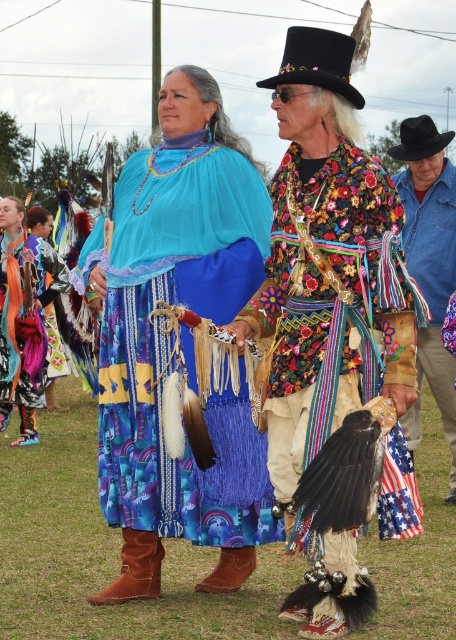
Between blue woven skirt at center and blue fabric dress at center, which one has more height?

Standing taller between the two is blue fabric dress at center.

Can you confirm if blue woven skirt at center is wider than blue fabric dress at center?

Yes.

Locate an element on the screen. blue woven skirt at center is located at coordinates (171, 340).

The width and height of the screenshot is (456, 640). In order to click on blue woven skirt at center in this screenshot , I will do `click(171, 340)`.

The image size is (456, 640). Describe the element at coordinates (171, 340) in the screenshot. I see `blue woven skirt at center` at that location.

You are a GUI agent. You are given a task and a screenshot of the screen. Output one action in this format:
    pyautogui.click(x=<x>, y=<y>)
    Task: Click on the blue woven skirt at center
    This screenshot has height=640, width=456.
    Given the screenshot: What is the action you would take?
    pyautogui.click(x=171, y=340)

Which of these two, blue woven skirt at center or shiny metallic headdress at upper center, stands taller?

With more height is blue woven skirt at center.

Does blue woven skirt at center come behind shiny metallic headdress at upper center?

That is False.

The height and width of the screenshot is (640, 456). What do you see at coordinates (171, 340) in the screenshot?
I see `blue woven skirt at center` at bounding box center [171, 340].

Locate an element on the screen. The width and height of the screenshot is (456, 640). blue woven skirt at center is located at coordinates (171, 340).